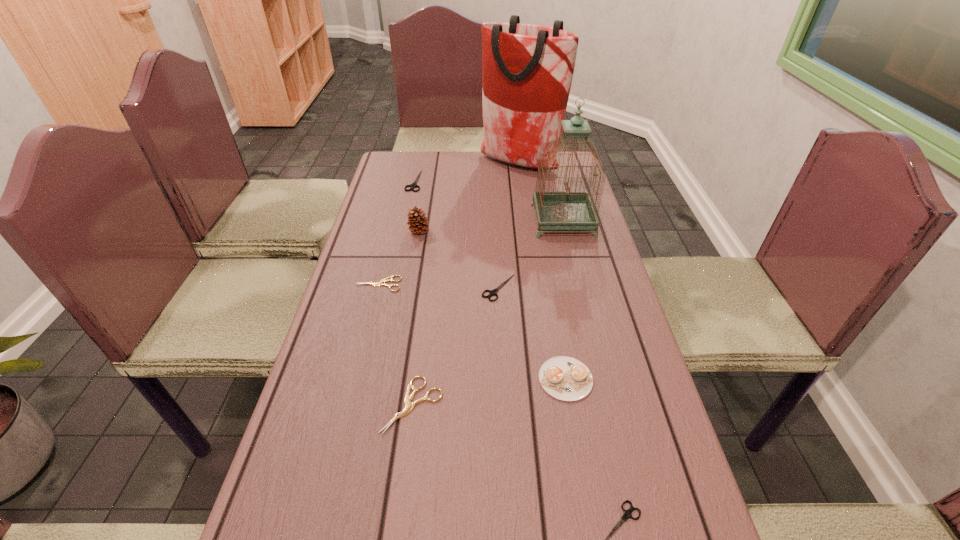
The height and width of the screenshot is (540, 960). Identify the location of cappuccino located in the right edge section of the desktop. (565, 378).

Locate an element on the screen. This screenshot has width=960, height=540. object that is at the far left corner is located at coordinates (414, 185).

Image resolution: width=960 pixels, height=540 pixels. Find the location of `object that is at the far right corner`. object that is at the far right corner is located at coordinates (527, 70).

Identify the location of vacant region at the far edge of the desktop. (487, 173).

In the image, there is a desktop. Where is `vacant space at the left edge`? Image resolution: width=960 pixels, height=540 pixels. vacant space at the left edge is located at coordinates (393, 245).

This screenshot has width=960, height=540. In the image, there is a desktop. What are the coordinates of `free region at the right edge` in the screenshot? It's located at (595, 291).

Locate an element on the screen. This screenshot has width=960, height=540. vacant space at the far left corner of the desktop is located at coordinates pos(396,164).

In order to click on free spot between the white cappuccino and the farthest shears in this screenshot , I will do `click(490, 280)`.

This screenshot has height=540, width=960. In order to click on free area in between the second biggest black shears and the left beige shears in this screenshot , I will do point(439,286).

In order to click on free space between the third tallest object and the left beige shears in this screenshot , I will do `click(398, 258)`.